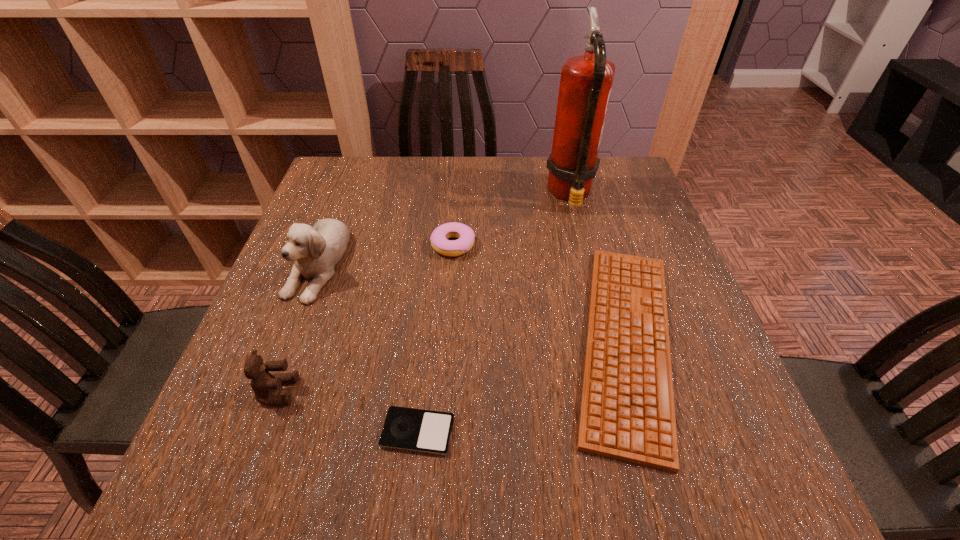
This screenshot has height=540, width=960. I want to click on free space located on the front-facing side of the puppy, so click(244, 454).

The image size is (960, 540). I want to click on free location located 0.060m on the face of the third tallest object, so click(329, 392).

The width and height of the screenshot is (960, 540). Identify the location of free space located 0.070m on the left of the doughnut. (401, 245).

Identify the location of free space located 0.330m on the back of the computer keyboard. (579, 177).

Find the location of a particular element. vacant region located on the back of the iPod is located at coordinates (428, 334).

At what (x,y) coordinates should I click in order to perform the action: click on object located in the far edge section of the desktop. Please return your answer as a coordinate pair (x, y). The width and height of the screenshot is (960, 540). Looking at the image, I should click on 586,80.

At what (x,y) coordinates should I click in order to perform the action: click on computer keyboard that is at the near edge. Please return your answer as a coordinate pair (x, y). Image resolution: width=960 pixels, height=540 pixels. Looking at the image, I should click on (627, 413).

What are the coordinates of `iPod present at the near edge` in the screenshot? It's located at (417, 430).

Where is `puppy situated at the left edge`? The height and width of the screenshot is (540, 960). puppy situated at the left edge is located at coordinates (316, 250).

Where is `teddy bear present at the left edge`? The height and width of the screenshot is (540, 960). teddy bear present at the left edge is located at coordinates (263, 383).